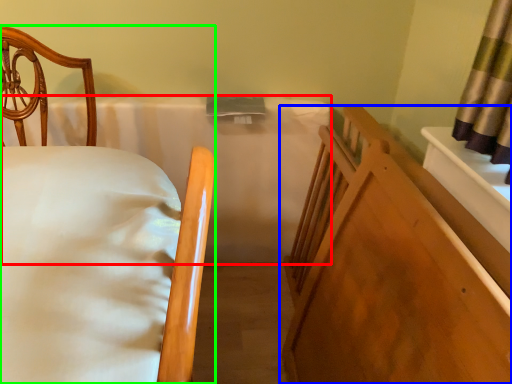
Question: Considering the real-world distances, which object is closest to mattress (highlighted by a red box)? furniture (highlighted by a blue box) or bed (highlighted by a green box).

Choices:
 (A) furniture
 (B) bed

Answer: (A)